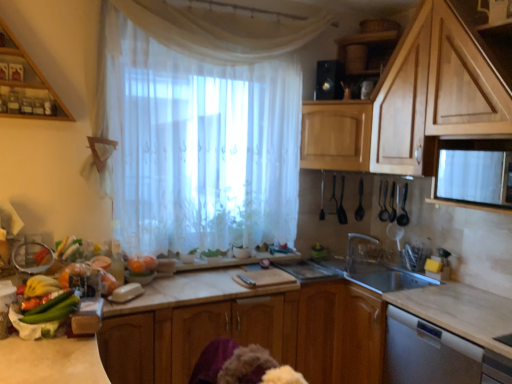
Question: Considering the relative sizes of wooden cabinet at center, which is counted as the 4th cabinetry, starting from the top, and silver metallic faucet at lower center in the image provided, is wooden cabinet at center, which is counted as the 4th cabinetry, starting from the top, taller than silver metallic faucet at lower center?

Choices:
 (A) yes
 (B) no

Answer: (A)

Question: Is silver metallic faucet at lower center at the back of wooden cabinet at center, the 1th cabinetry positioned from the bottom?

Choices:
 (A) yes
 (B) no

Answer: (B)

Question: From a real-world perspective, is wooden cabinet at center, which is counted as the 4th cabinetry, starting from the top, beneath silver metallic faucet at lower center?

Choices:
 (A) no
 (B) yes

Answer: (B)

Question: Considering the relative sizes of wooden cabinet at center, which is counted as the 4th cabinetry, starting from the top, and silver metallic faucet at lower center in the image provided, is wooden cabinet at center, which is counted as the 4th cabinetry, starting from the top, thinner than silver metallic faucet at lower center?

Choices:
 (A) no
 (B) yes

Answer: (A)

Question: From a real-world perspective, is wooden cabinet at center, which is counted as the 4th cabinetry, starting from the top, on top of silver metallic faucet at lower center?

Choices:
 (A) yes
 (B) no

Answer: (B)

Question: Would you say silver metallic faucet at lower center is part of wooden cabinet at center, the 1th cabinetry positioned from the bottom,'s contents?

Choices:
 (A) no
 (B) yes

Answer: (A)

Question: From the image's perspective, is marble countertop at center on white sheer curtain at center?

Choices:
 (A) no
 (B) yes

Answer: (A)

Question: Does marble countertop at center lie behind white sheer curtain at center?

Choices:
 (A) no
 (B) yes

Answer: (A)

Question: Is marble countertop at center next to white sheer curtain at center and touching it?

Choices:
 (A) no
 (B) yes

Answer: (A)

Question: Considering the relative positions of marble countertop at center and white sheer curtain at center in the image provided, is marble countertop at center to the right of white sheer curtain at center from the viewer's perspective?

Choices:
 (A) yes
 (B) no

Answer: (A)

Question: Does marble countertop at center have a greater width compared to white sheer curtain at center?

Choices:
 (A) no
 (B) yes

Answer: (B)

Question: Is marble countertop at center oriented away from white sheer curtain at center?

Choices:
 (A) no
 (B) yes

Answer: (A)

Question: Is green matte cucumber at lower left placed right next to black plastic spoon at right, placed as the third appliance when sorted from right to left?

Choices:
 (A) yes
 (B) no

Answer: (B)